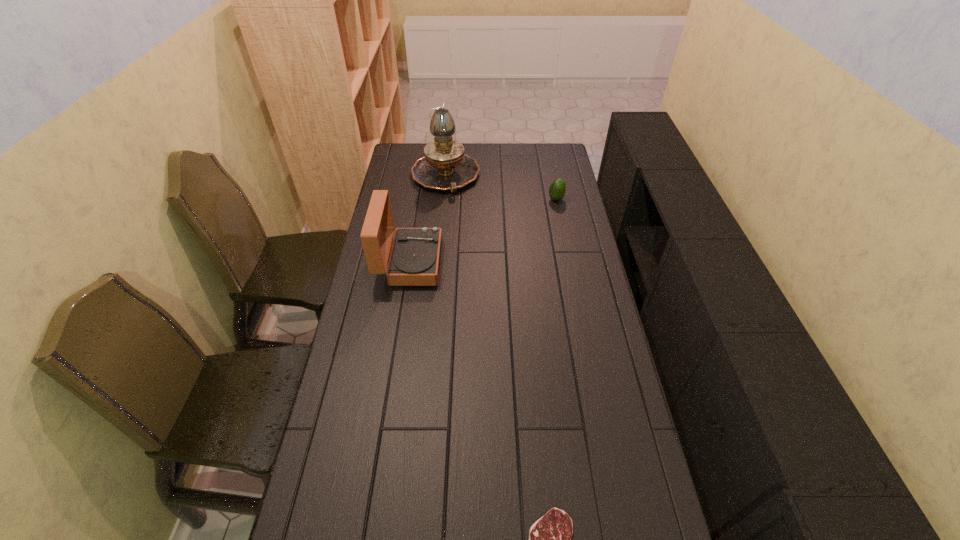
What are the coordinates of `the tallest object` in the screenshot? It's located at (444, 166).

Identify the location of phonograph record. (415, 255).

Where is `the third farthest object`? the third farthest object is located at coordinates (415, 255).

Locate an element on the screen. The width and height of the screenshot is (960, 540). avocado is located at coordinates (557, 190).

Locate an element on the screen. This screenshot has width=960, height=540. the rightmost object is located at coordinates (557, 190).

Locate an element on the screen. blank space located 0.160m on the front of the tallest object is located at coordinates (441, 221).

Locate an element on the screen. The width and height of the screenshot is (960, 540). free space located 0.110m on the face of the phonograph record is located at coordinates (469, 262).

Locate an element on the screen. The height and width of the screenshot is (540, 960). free spot located 0.300m on the front of the third tallest object is located at coordinates (566, 251).

In order to click on object that is at the far edge in this screenshot , I will do `click(444, 166)`.

At what (x,y) coordinates should I click in order to perform the action: click on oil lamp located at the left edge. Please return your answer as a coordinate pair (x, y). Looking at the image, I should click on (444, 166).